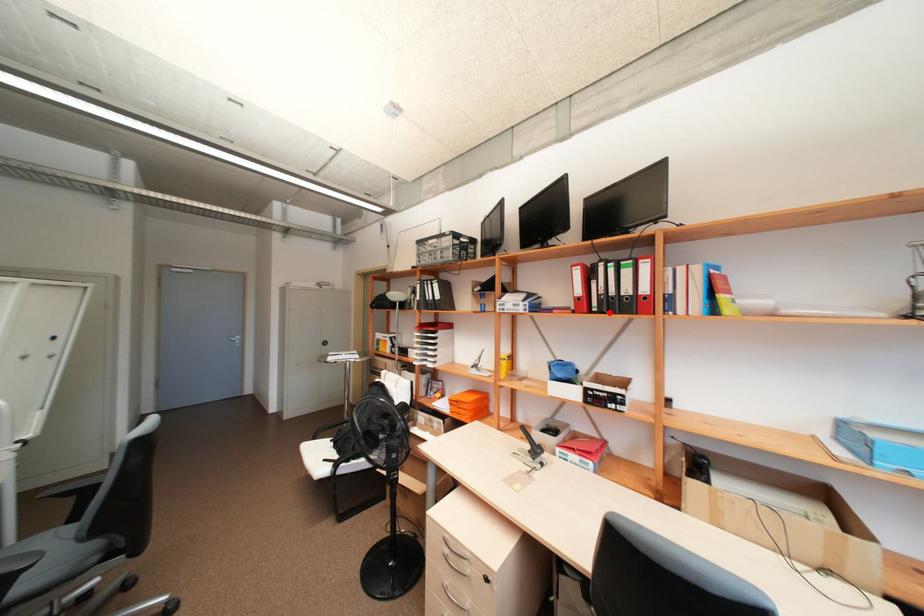
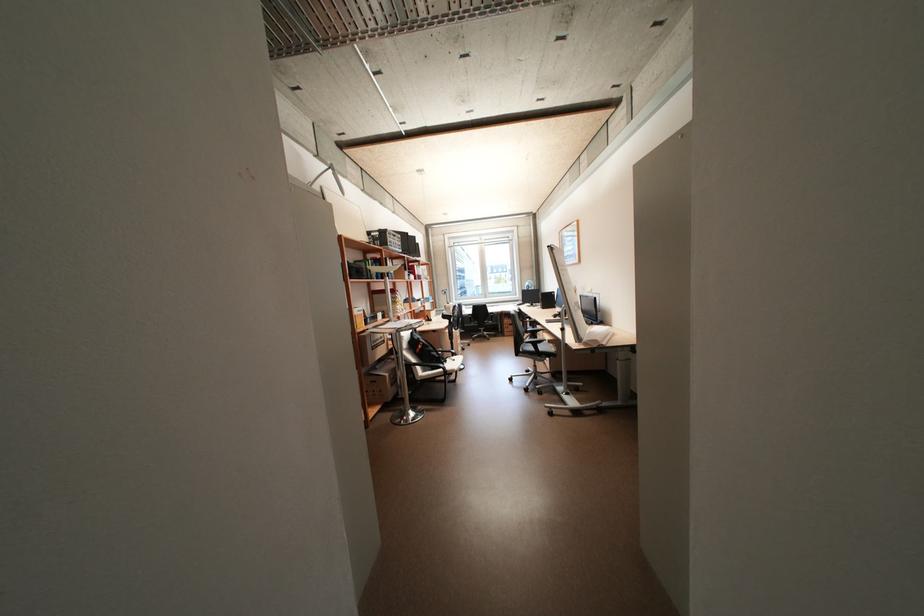
Question: I am providing you with two images of the same scene from different viewpoints. A red point is marked on the first image. At the location where the point appears in image 1, is it still visible in image 2?

Choices:
 (A) Yes
 (B) No

Answer: (B)